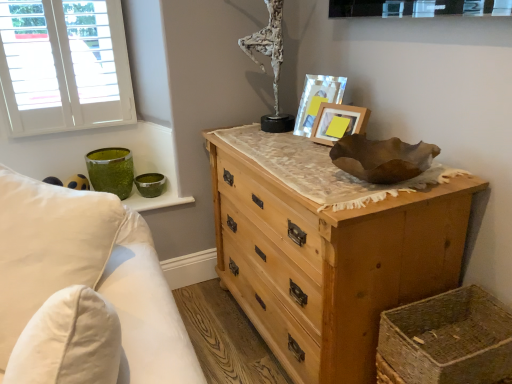
Question: From the image's perspective, is white textured sculpture at upper center located beneath white painted wood window at upper left?

Choices:
 (A) yes
 (B) no

Answer: (B)

Question: Does white textured sculpture at upper center turn towards white painted wood window at upper left?

Choices:
 (A) yes
 (B) no

Answer: (B)

Question: Is white textured sculpture at upper center taller than white painted wood window at upper left?

Choices:
 (A) yes
 (B) no

Answer: (B)

Question: Considering the relative sizes of white textured sculpture at upper center and white painted wood window at upper left in the image provided, is white textured sculpture at upper center thinner than white painted wood window at upper left?

Choices:
 (A) yes
 (B) no

Answer: (B)

Question: Is white textured sculpture at upper center positioned before white painted wood window at upper left?

Choices:
 (A) yes
 (B) no

Answer: (A)

Question: In terms of height, does white painted wood window at upper left look taller or shorter compared to woven straw basket at lower right?

Choices:
 (A) tall
 (B) short

Answer: (A)

Question: Looking at their shapes, would you say white painted wood window at upper left is wider or thinner than woven straw basket at lower right?

Choices:
 (A) wide
 (B) thin

Answer: (B)

Question: Is point (121, 51) closer or farther from the camera than point (415, 317)?

Choices:
 (A) closer
 (B) farther

Answer: (B)

Question: From the image's perspective, relative to woven straw basket at lower right, is white painted wood window at upper left above or below?

Choices:
 (A) below
 (B) above

Answer: (B)

Question: Is woven straw basket at lower right in front of or behind natural wood chest of drawers at center in the image?

Choices:
 (A) behind
 (B) front

Answer: (B)

Question: Choose the correct answer: Is woven straw basket at lower right inside natural wood chest of drawers at center or outside it?

Choices:
 (A) outside
 (B) inside

Answer: (A)

Question: Considering the positions of woven straw basket at lower right and natural wood chest of drawers at center in the image, is woven straw basket at lower right wider or thinner than natural wood chest of drawers at center?

Choices:
 (A) thin
 (B) wide

Answer: (A)

Question: From the image's perspective, relative to natural wood chest of drawers at center, is woven straw basket at lower right above or below?

Choices:
 (A) above
 (B) below

Answer: (B)

Question: Is white soft pillow at left to the left or to the right of wooden picture frame at upper center, arranged as the 1th picture frame when viewed from the front, in the image?

Choices:
 (A) right
 (B) left

Answer: (B)

Question: From a real-world perspective, is white soft pillow at left above or below wooden picture frame at upper center, the second picture frame when ordered from back to front?

Choices:
 (A) above
 (B) below

Answer: (B)